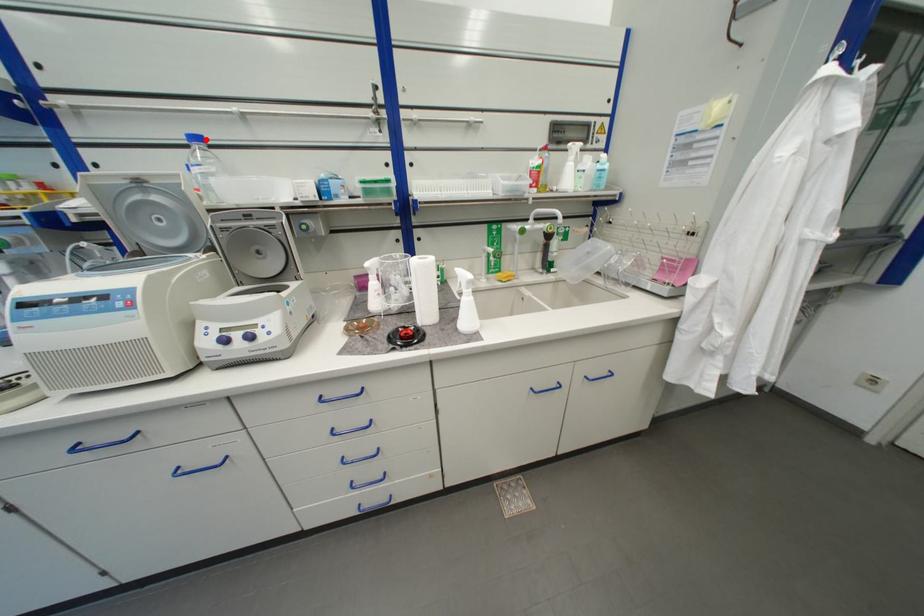
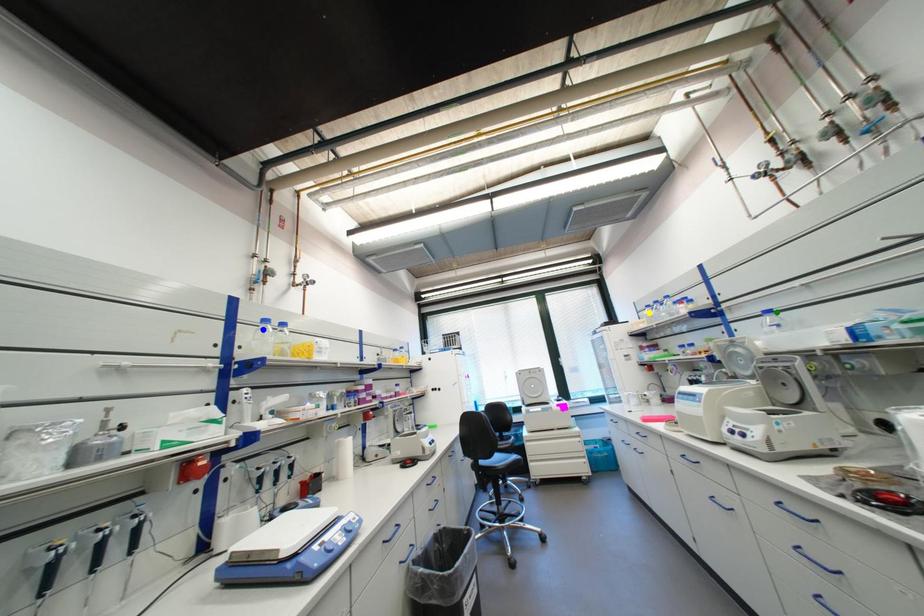
Question: I am providing you with two images of the same scene from different viewpoints. A red point is marked on the first image. You are given multiple points on the second image. Which spot in image 2 lines up with the point in image 1?

Choices:
 (A) blue point
 (B) green point
 (C) yellow point

Answer: (B)